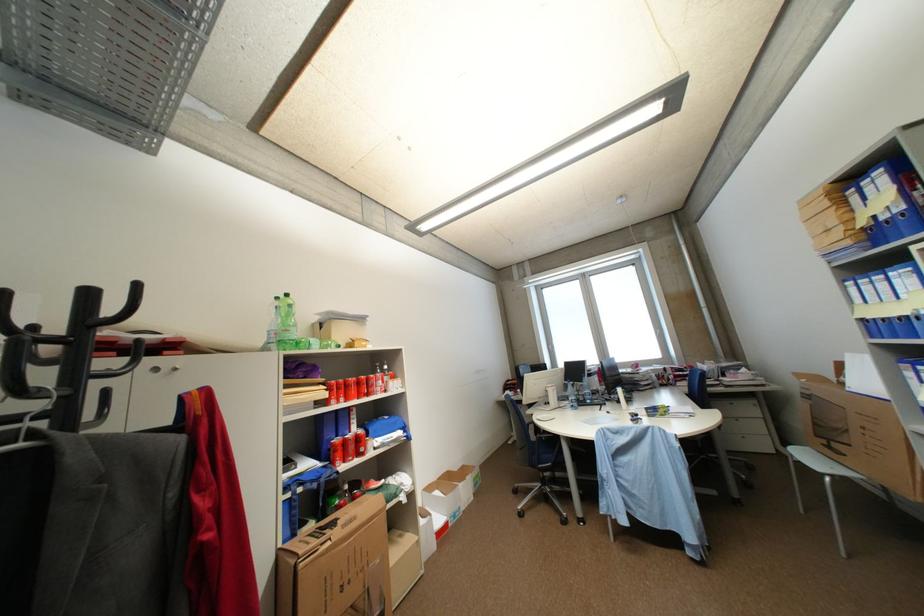
Where would you pull the window handle? Please return your answer as a coordinate pair (x, y).

(548, 351)